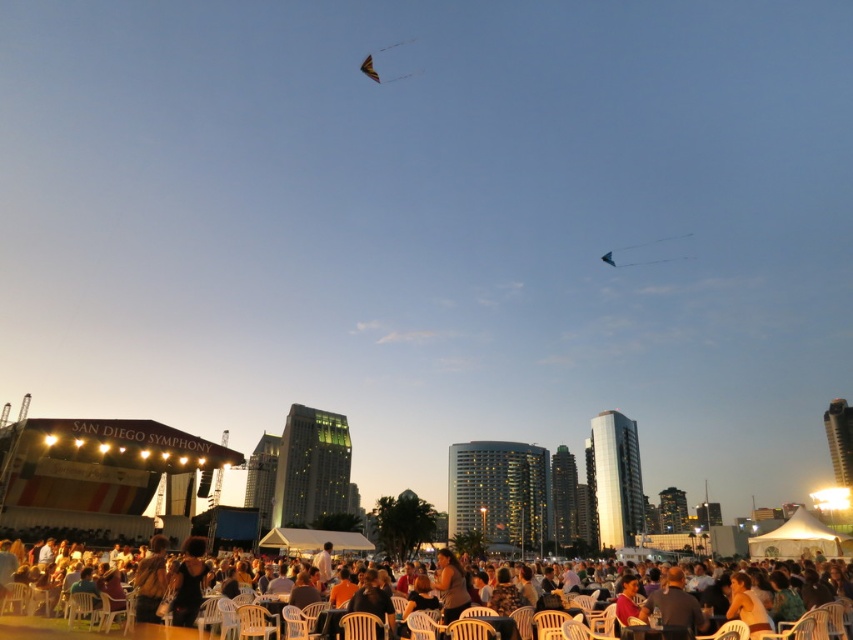
Is translucent blue kite at upper right wider than multicolored fabric kite at upper center?

Correct, the width of translucent blue kite at upper right exceeds that of multicolored fabric kite at upper center.

Between translucent blue kite at upper right and multicolored fabric kite at upper center, which one is positioned higher?

multicolored fabric kite at upper center is higher up.

Between point (640, 246) and point (364, 60), which one is positioned in front?

Positioned in front is point (640, 246).

You are a GUI agent. You are given a task and a screenshot of the screen. Output one action in this format:
    pyautogui.click(x=<x>, y=<y>)
    Task: Click on the translucent blue kite at upper right
    
    Given the screenshot: What is the action you would take?
    pyautogui.click(x=654, y=241)

Is white plastic chairs at lower center to the left of multicolored fabric kite at upper center from the viewer's perspective?

In fact, white plastic chairs at lower center is to the right of multicolored fabric kite at upper center.

Describe the element at coordinates (84, 630) in the screenshot. I see `white plastic chairs at lower center` at that location.

Where is `white plastic chairs at lower center`? The width and height of the screenshot is (853, 640). white plastic chairs at lower center is located at coordinates (84, 630).

Does white plastic chairs at lower center appear on the right side of blonde hair at center?

No, white plastic chairs at lower center is not to the right of blonde hair at center.

What do you see at coordinates (84, 630) in the screenshot? I see `white plastic chairs at lower center` at bounding box center [84, 630].

Identify the location of white plastic chairs at lower center. The height and width of the screenshot is (640, 853). (84, 630).